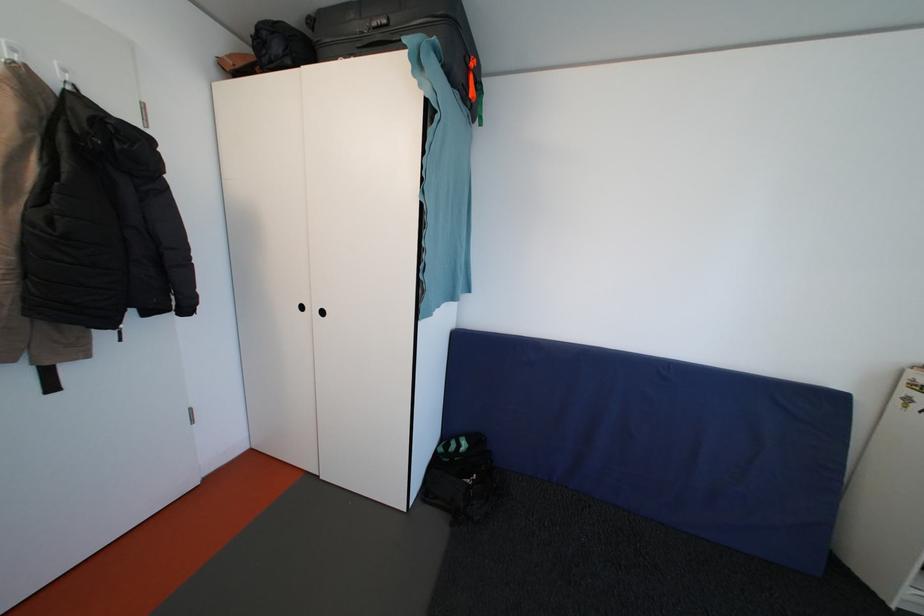
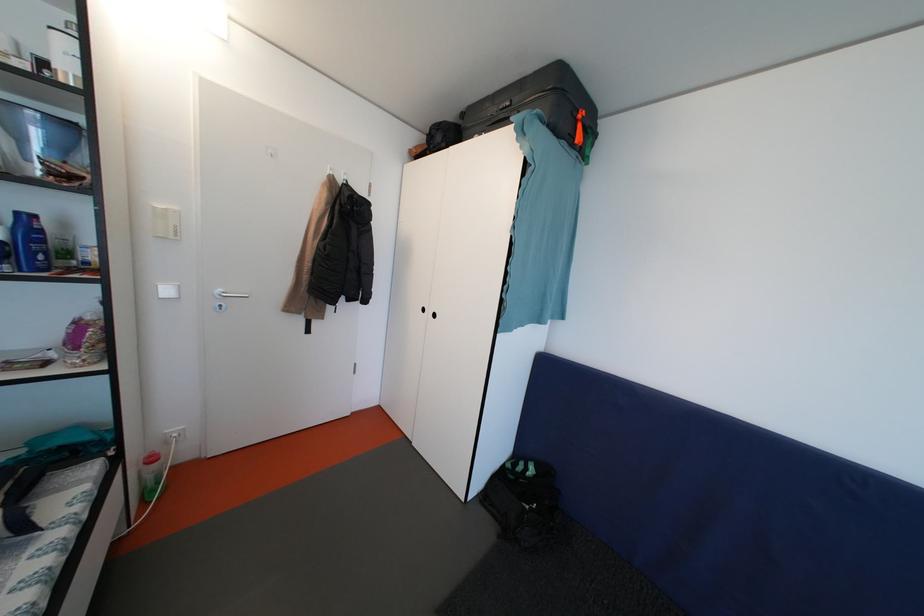
Find the pixel in the second image that matches [467,451] in the first image.

(533, 474)